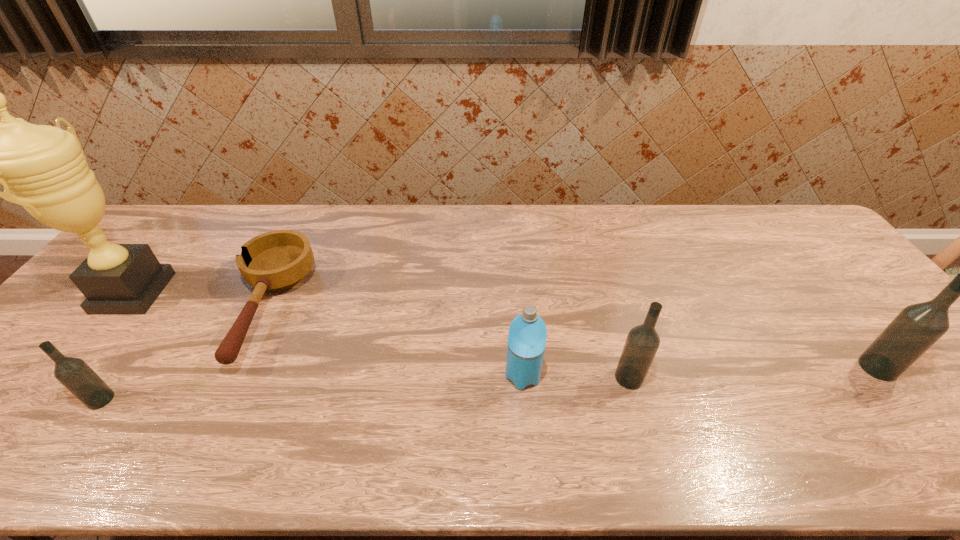
Locate an element on the screen. Image resolution: width=960 pixels, height=540 pixels. vacant region that satisfies the following two spatial constraints: 1. at the front of the rightmost object with handles; 2. on the right side of the trophy cup is located at coordinates (73, 368).

Locate an element on the screen. The height and width of the screenshot is (540, 960). free region that satisfies the following two spatial constraints: 1. on the back side of the second vodka from right to left; 2. on the left side of the rightmost vodka is located at coordinates pyautogui.click(x=626, y=368).

Locate an element on the screen. Image resolution: width=960 pixels, height=540 pixels. free point that satisfies the following two spatial constraints: 1. with the handle on the side of the shortest object; 2. on the right side of the third object from right to left is located at coordinates (234, 376).

Identify the location of vacant region that satisfies the following two spatial constraints: 1. on the back side of the fifth object from right to left; 2. on the right side of the rightmost object. The width and height of the screenshot is (960, 540). (124, 368).